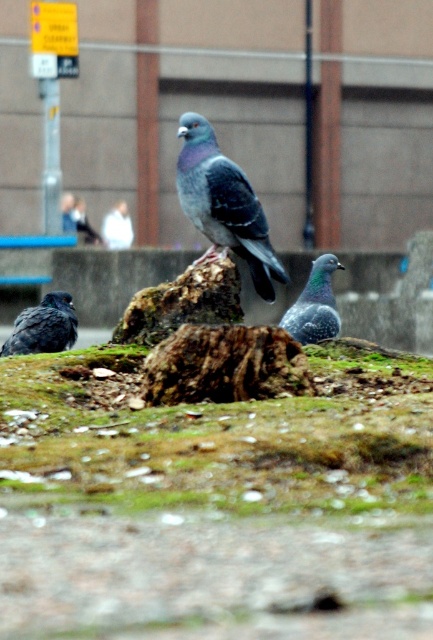
You are standing at the point labeled point (x=89, y=412) and want to walk towards the point labeled point (x=328, y=278). According to the scene description, will you be moving towards or away from the central pigeon?

Since point (x=89, y=412) is in front of point (x=328, y=278), moving from point (x=89, y=412) towards point (x=328, y=278) means you are moving away from the central pigeon.